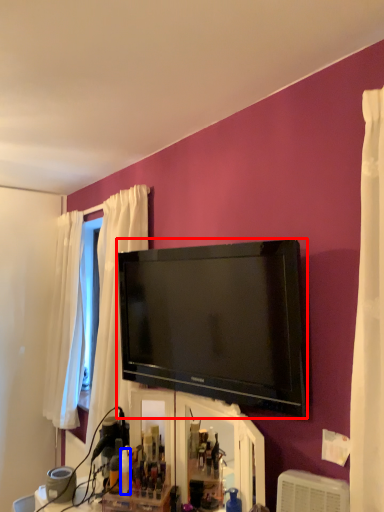
Question: Which point is closer to the camera, television (highlighted by a red box) or toiletry (highlighted by a blue box)?

Choices:
 (A) television
 (B) toiletry

Answer: (A)